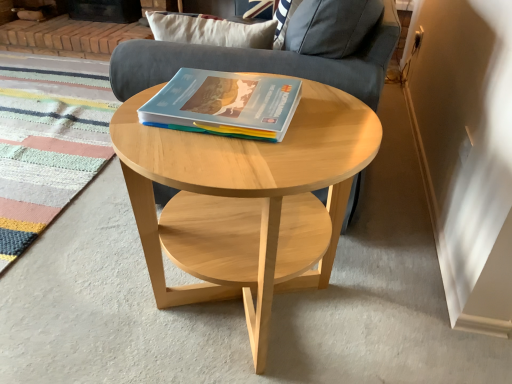
Find the location of a particular element. The image size is (512, 384). vacant space that is to the left of natural wood coffee table at center is located at coordinates (82, 279).